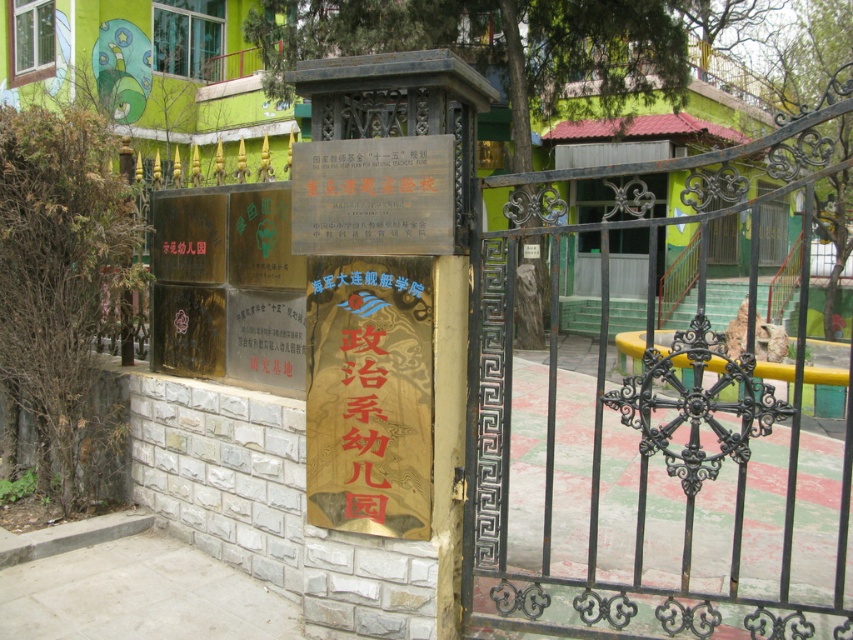
Question: Which point is closer to the camera?

Choices:
 (A) black wrought iron gate at center
 (B) gold textured sign at center
 (C) gold metallic sign at center

Answer: (A)

Question: Is gold textured sign at center thinner than gold metallic sign at center?

Choices:
 (A) yes
 (B) no

Answer: (A)

Question: Which is nearer to the black wrought iron gate at center?

Choices:
 (A) gold metallic sign at center
 (B) gold textured sign at center

Answer: (A)

Question: Among these points, which one is nearest to the camera?

Choices:
 (A) (730, 189)
 (B) (432, 342)

Answer: (A)

Question: Does gold textured sign at center appear over gold metallic sign at center?

Choices:
 (A) no
 (B) yes

Answer: (A)

Question: Can you confirm if black wrought iron gate at center is thinner than gold metallic sign at center?

Choices:
 (A) no
 (B) yes

Answer: (A)